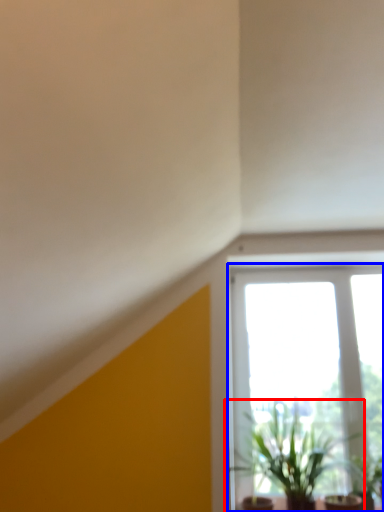
Question: Which object appears closest to the camera in this image, houseplant (highlighted by a red box) or window (highlighted by a blue box)?

Choices:
 (A) houseplant
 (B) window

Answer: (A)